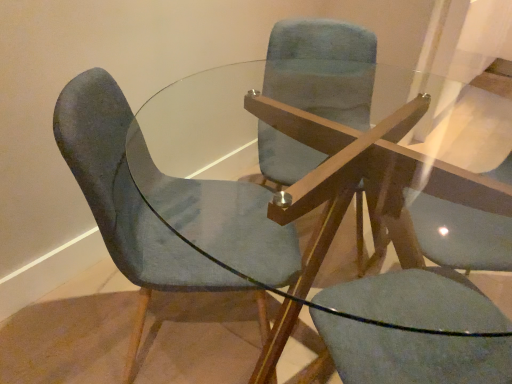
Question: Does matte blue swivel chair at center have a greater height compared to velvet blue chair at left, arranged as the second chair when viewed from the left?

Choices:
 (A) yes
 (B) no

Answer: (A)

Question: Is matte blue swivel chair at center outside velvet blue chair at left, arranged as the second chair when viewed from the left?

Choices:
 (A) no
 (B) yes

Answer: (A)

Question: Is matte blue swivel chair at center to the left of velvet blue chair at left, arranged as the second chair when viewed from the left, from the viewer's perspective?

Choices:
 (A) no
 (B) yes

Answer: (A)

Question: Is matte blue swivel chair at center aimed at velvet blue chair at left, the first chair viewed from the right?

Choices:
 (A) no
 (B) yes

Answer: (B)

Question: Is matte blue swivel chair at center thinner than velvet blue chair at left, arranged as the second chair when viewed from the left?

Choices:
 (A) no
 (B) yes

Answer: (B)

Question: Is matte blue swivel chair at center far away from velvet blue chair at left, arranged as the second chair when viewed from the left?

Choices:
 (A) yes
 (B) no

Answer: (B)

Question: Would you say velvet blue chair at center, arranged as the 1th chair when viewed from the left, contains matte blue swivel chair at center?

Choices:
 (A) yes
 (B) no

Answer: (B)

Question: From a real-world perspective, is velvet blue chair at center, arranged as the 1th chair when viewed from the left, physically below matte blue swivel chair at center?

Choices:
 (A) no
 (B) yes

Answer: (A)

Question: Is velvet blue chair at center, acting as the 2th chair starting from the right, facing towards matte blue swivel chair at center?

Choices:
 (A) yes
 (B) no

Answer: (A)

Question: Considering the relative sizes of velvet blue chair at center, acting as the 2th chair starting from the right, and matte blue swivel chair at center in the image provided, is velvet blue chair at center, acting as the 2th chair starting from the right, taller than matte blue swivel chair at center?

Choices:
 (A) yes
 (B) no

Answer: (B)

Question: Does velvet blue chair at center, acting as the 2th chair starting from the right, have a larger size compared to matte blue swivel chair at center?

Choices:
 (A) no
 (B) yes

Answer: (A)

Question: Considering the relative sizes of velvet blue chair at center, acting as the 2th chair starting from the right, and matte blue swivel chair at center in the image provided, is velvet blue chair at center, acting as the 2th chair starting from the right, smaller than matte blue swivel chair at center?

Choices:
 (A) no
 (B) yes

Answer: (B)

Question: Does velvet blue chair at center, acting as the 2th chair starting from the right, have a greater height compared to velvet blue chair at left, the first chair viewed from the right?

Choices:
 (A) yes
 (B) no

Answer: (A)